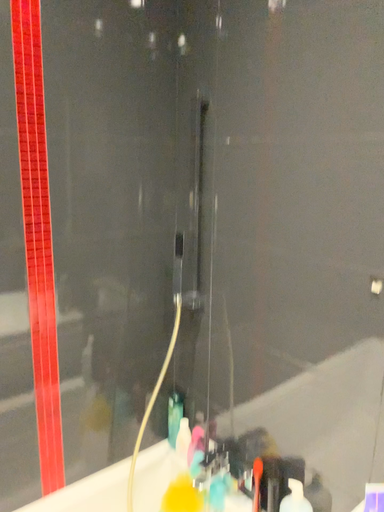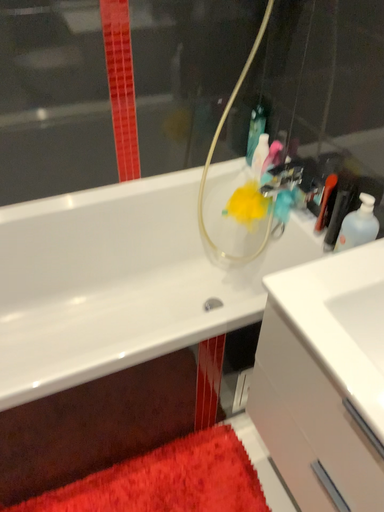
Question: Which way did the camera rotate in the video?

Choices:
 (A) rotated upward
 (B) rotated downward

Answer: (B)